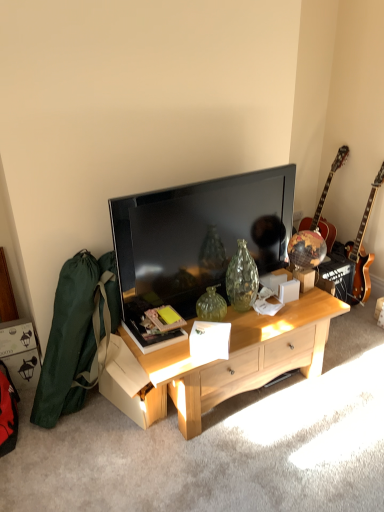
Question: Is the depth of matte black tv at center less than that of light wood cabinet at center?

Choices:
 (A) no
 (B) yes

Answer: (A)

Question: Does matte black tv at center touch light wood cabinet at center?

Choices:
 (A) no
 (B) yes

Answer: (A)

Question: Would you say matte black tv at center is outside light wood cabinet at center?

Choices:
 (A) yes
 (B) no

Answer: (A)

Question: From a real-world perspective, is matte black tv at center physically above light wood cabinet at center?

Choices:
 (A) yes
 (B) no

Answer: (A)

Question: Can you confirm if matte black tv at center is positioned to the right of light wood cabinet at center?

Choices:
 (A) no
 (B) yes

Answer: (A)

Question: Relative to light wood cabinet at center, is glossy wood guitar at right, the first guitar positioned from the right, in front or behind?

Choices:
 (A) front
 (B) behind

Answer: (B)

Question: From the image's perspective, is glossy wood guitar at right, the first guitar positioned from the right, positioned above or below light wood cabinet at center?

Choices:
 (A) below
 (B) above

Answer: (B)

Question: From their relative heights in the image, would you say glossy wood guitar at right, the second guitar positioned from the left, is taller or shorter than light wood cabinet at center?

Choices:
 (A) tall
 (B) short

Answer: (A)

Question: Based on their sizes in the image, would you say glossy wood guitar at right, the second guitar positioned from the left, is bigger or smaller than light wood cabinet at center?

Choices:
 (A) big
 (B) small

Answer: (B)

Question: Considering the positions of point (319, 199) and point (357, 231), is point (319, 199) closer or farther from the camera than point (357, 231)?

Choices:
 (A) farther
 (B) closer

Answer: (A)

Question: From the image's perspective, is wooden acoustic guitar at right, the 2th guitar in the right-to-left sequence, above or below glossy wood guitar at right, the second guitar positioned from the left?

Choices:
 (A) above
 (B) below

Answer: (A)

Question: Looking at their shapes, would you say wooden acoustic guitar at right, the 2th guitar in the right-to-left sequence, is wider or thinner than glossy wood guitar at right, the second guitar positioned from the left?

Choices:
 (A) wide
 (B) thin

Answer: (A)

Question: In the image, is wooden acoustic guitar at right, which is counted as the 1th guitar, starting from the left, positioned in front of or behind glossy wood guitar at right, the second guitar positioned from the left?

Choices:
 (A) behind
 (B) front

Answer: (A)

Question: From a real-world perspective, is light wood cabinet at center above or below wooden acoustic guitar at right, which is counted as the 1th guitar, starting from the left?

Choices:
 (A) above
 (B) below

Answer: (B)

Question: Considering the positions of light wood cabinet at center and wooden acoustic guitar at right, the 2th guitar in the right-to-left sequence, in the image, is light wood cabinet at center bigger or smaller than wooden acoustic guitar at right, the 2th guitar in the right-to-left sequence,?

Choices:
 (A) small
 (B) big

Answer: (B)